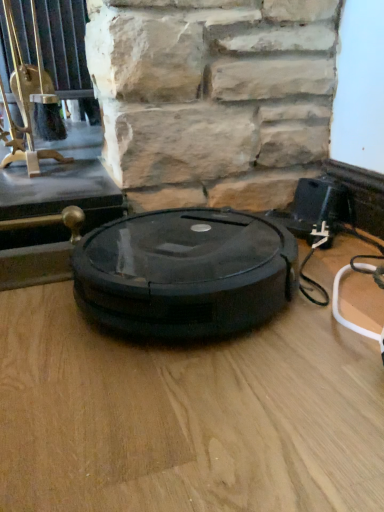
Question: Is black plastic robot vacuum cleaner at center bigger or smaller than brushed metal fireplace tool at upper left?

Choices:
 (A) small
 (B) big

Answer: (A)

Question: From the image's perspective, is black plastic robot vacuum cleaner at center located above or below brushed metal fireplace tool at upper left?

Choices:
 (A) above
 (B) below

Answer: (B)

Question: Considering the positions of black plastic robot vacuum cleaner at center and brushed metal fireplace tool at upper left in the image, is black plastic robot vacuum cleaner at center taller or shorter than brushed metal fireplace tool at upper left?

Choices:
 (A) tall
 (B) short

Answer: (B)

Question: From the image's perspective, is brushed metal fireplace tool at upper left above or below black plastic robot vacuum cleaner at center?

Choices:
 (A) below
 (B) above

Answer: (B)

Question: From a real-world perspective, is brushed metal fireplace tool at upper left physically located above or below black plastic robot vacuum cleaner at center?

Choices:
 (A) below
 (B) above

Answer: (B)

Question: Relative to black plastic robot vacuum cleaner at center, is brushed metal fireplace tool at upper left in front or behind?

Choices:
 (A) behind
 (B) front

Answer: (A)

Question: Would you say brushed metal fireplace tool at upper left is inside or outside black plastic robot vacuum cleaner at center?

Choices:
 (A) outside
 (B) inside

Answer: (A)